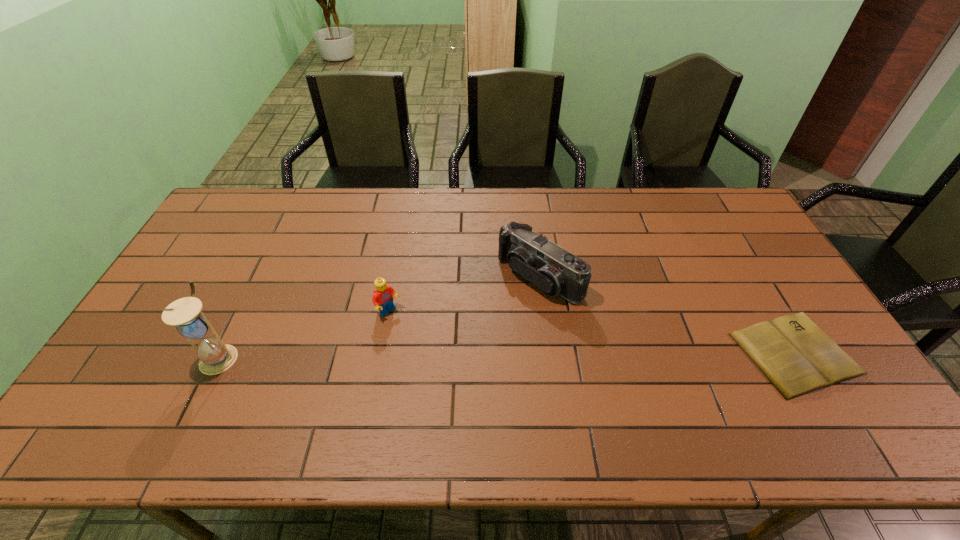
The image size is (960, 540). What are the coordinates of `free space that is in between the leftmost object and the second object from right to left` in the screenshot? It's located at (379, 316).

At what (x,y) coordinates should I click in order to perform the action: click on vacant space that's between the leftmost object and the camcorder. Please return your answer as a coordinate pair (x, y). Image resolution: width=960 pixels, height=540 pixels. Looking at the image, I should click on (379, 316).

The height and width of the screenshot is (540, 960). I want to click on vacant area that lies between the shortest object and the tallest object, so click(x=508, y=355).

The image size is (960, 540). Identify the location of object that ranks as the third closest to the second shortest object. (795, 355).

The width and height of the screenshot is (960, 540). Find the location of `object that stands as the third closest to the second object from right to left`. object that stands as the third closest to the second object from right to left is located at coordinates (215, 357).

You are a GUI agent. You are given a task and a screenshot of the screen. Output one action in this format:
    pyautogui.click(x=<x>, y=<y>)
    Task: Click on the vacant space that satisfies the following two spatial constraints: 1. on the back side of the second object from right to left; 2. on the left side of the second object from left to right
    This screenshot has width=960, height=540.
    Given the screenshot: What is the action you would take?
    pyautogui.click(x=396, y=277)

The image size is (960, 540). Find the location of `free space that satisfies the following two spatial constraints: 1. on the back side of the shortest object; 2. on the right side of the leftmost object`. free space that satisfies the following two spatial constraints: 1. on the back side of the shortest object; 2. on the right side of the leftmost object is located at coordinates (222, 353).